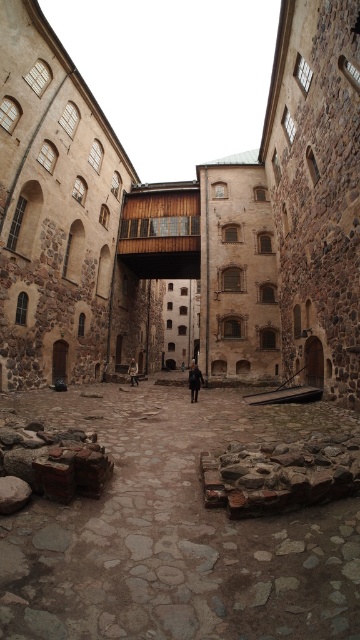
Question: Is brown stone courtyard at center smaller than rustic stone courtyard at center?

Choices:
 (A) no
 (B) yes

Answer: (A)

Question: Which of these objects is positioned farthest from the dark brown leather coat at center?

Choices:
 (A) brown leather jacket at center
 (B) brown stone courtyard at center

Answer: (B)

Question: Which point is closer to the camera?

Choices:
 (A) (x=163, y=630)
 (B) (x=66, y=232)
 (C) (x=133, y=384)
 (D) (x=191, y=365)

Answer: (A)

Question: Does brown stone courtyard at center have a greater width compared to dark brown leather coat at center?

Choices:
 (A) yes
 (B) no

Answer: (A)

Question: Which of the following is the farthest from the observer?

Choices:
 (A) (191, 368)
 (B) (131, 369)
 (C) (240, 525)
 (D) (257, 371)

Answer: (A)

Question: Is rustic stone courtyard at center thinner than dark brown leather coat at center?

Choices:
 (A) no
 (B) yes

Answer: (A)